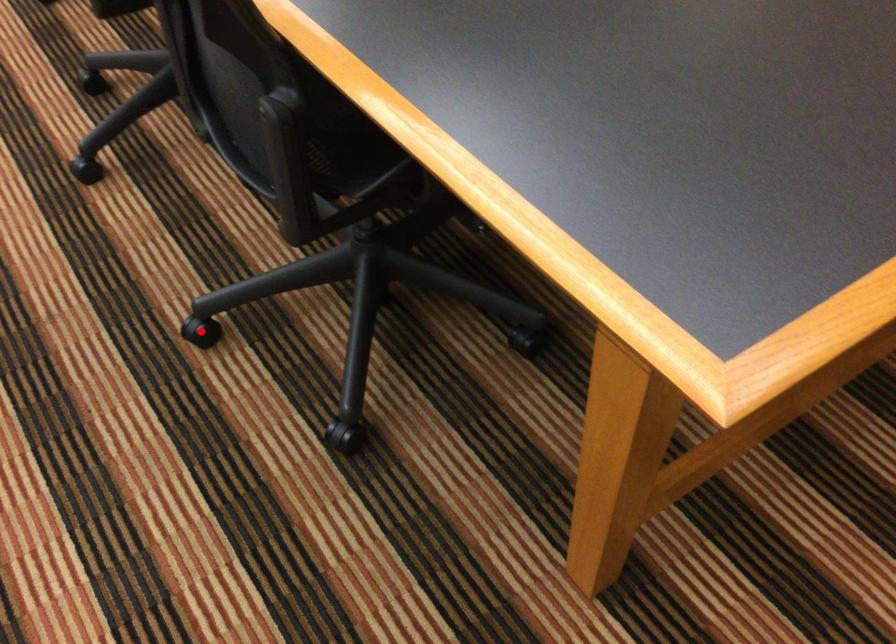
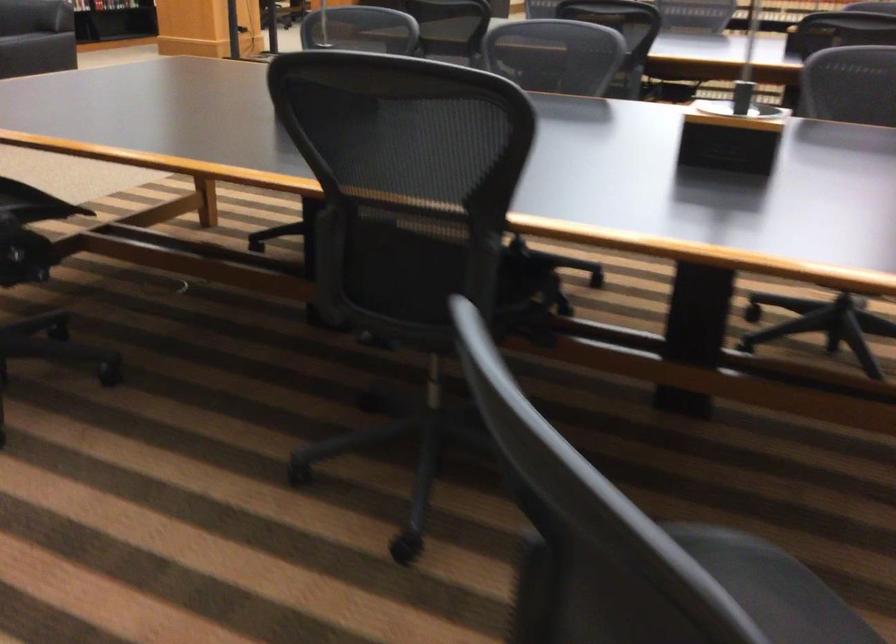
Question: I am providing you with two images of the same scene from different viewpoints. A red point is marked on the first image. Is the red point's position out of view in image 2?

Choices:
 (A) Yes
 (B) No

Answer: (A)